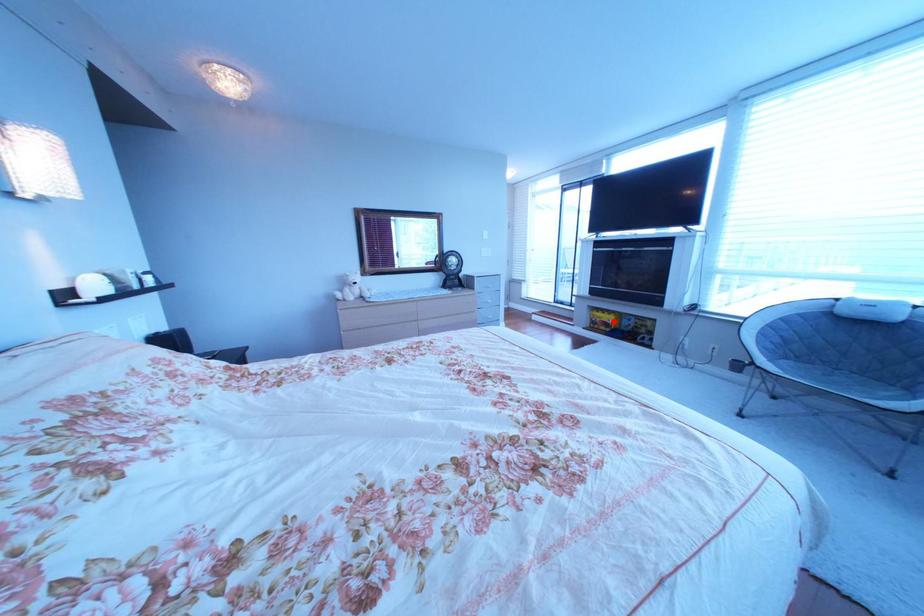
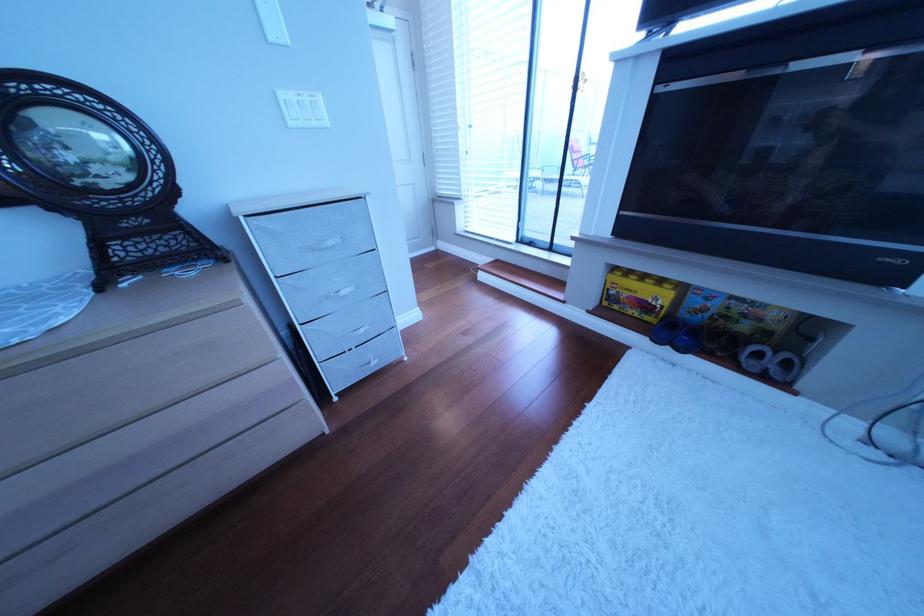
Where in the second image is the point corresponding to the highlighted location from the first image?

(640, 296)